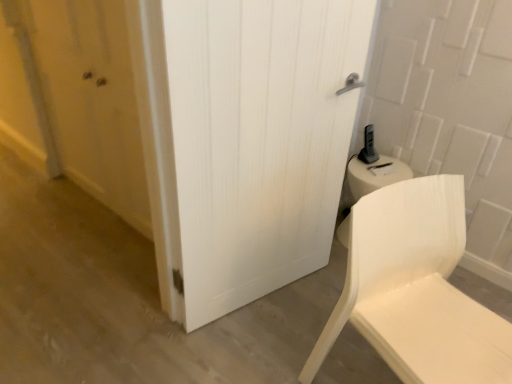
What are the coordinates of `free point in front of matte wooden door at left` in the screenshot? It's located at (90, 266).